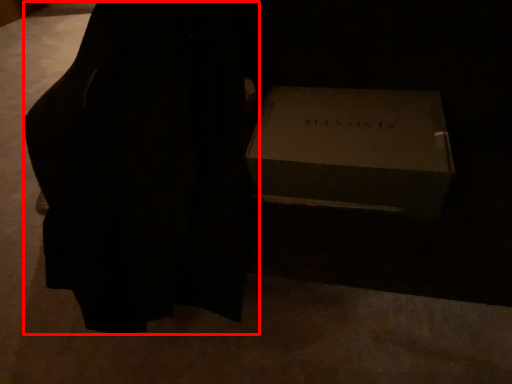
Question: In this image, where is dress (annotated by the red box) located relative to box?

Choices:
 (A) right
 (B) left

Answer: (B)